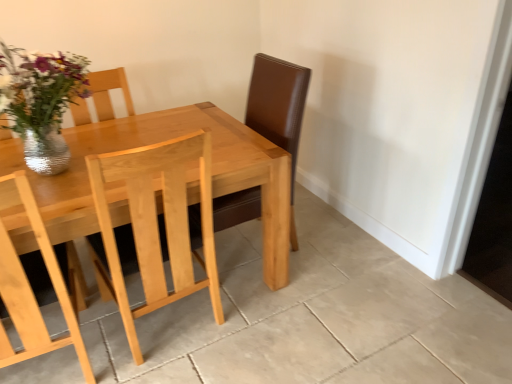
Find the location of a particular element. free space behind metallic silver vase at upper left is located at coordinates 103,135.